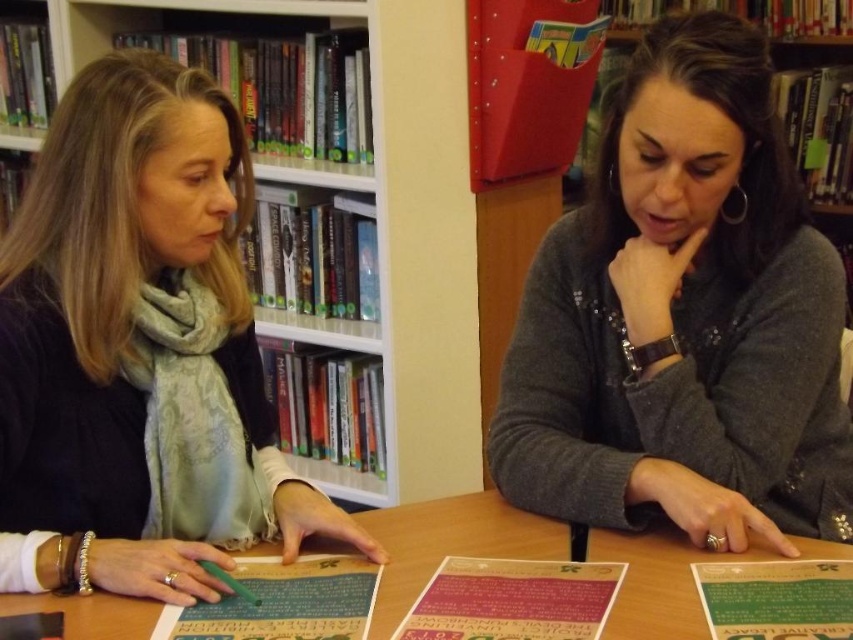
Can you confirm if green plastic pen at lower left is bigger than green paper at center?

Correct, green plastic pen at lower left is larger in size than green paper at center.

Describe the element at coordinates (283, 602) in the screenshot. The image size is (853, 640). I see `green plastic pen at lower left` at that location.

Locate an element on the screen. Image resolution: width=853 pixels, height=640 pixels. green plastic pen at lower left is located at coordinates (283, 602).

Can you confirm if gray matte sweater at center is positioned to the left of smooth wooden table at center?

No, gray matte sweater at center is not to the left of smooth wooden table at center.

Can you confirm if gray matte sweater at center is bigger than smooth wooden table at center?

Correct, gray matte sweater at center is larger in size than smooth wooden table at center.

Where is `gray matte sweater at center`? gray matte sweater at center is located at coordinates (683, 320).

Can you confirm if gray matte sweater at center is positioned below matte pink paper at center?

Actually, gray matte sweater at center is above matte pink paper at center.

In the scene shown: Is the position of gray matte sweater at center less distant than that of matte pink paper at center?

No, it is behind matte pink paper at center.

Which is in front, point (651, 92) or point (476, 608)?

Point (476, 608) is more forward.

Identify the location of gray matte sweater at center. The width and height of the screenshot is (853, 640). click(683, 320).